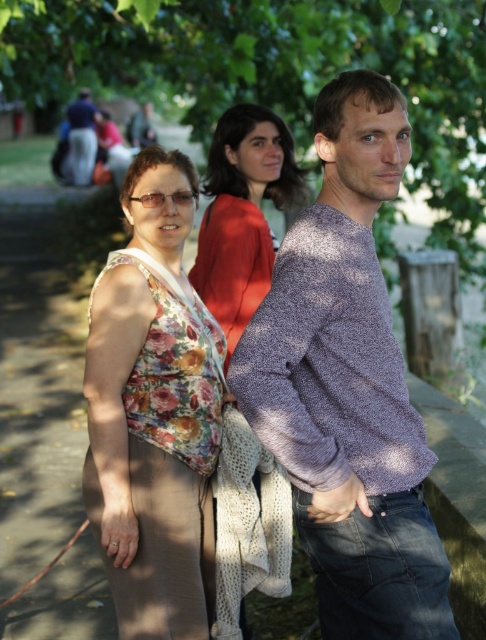
Between floral fabric top at center and dark blue sweater at center, which one appears on the left side from the viewer's perspective?

dark blue sweater at center

Which is in front, point (191, 387) or point (82, 164)?

Point (191, 387) is in front.

Describe the element at coordinates (151, 452) in the screenshot. This screenshot has height=640, width=486. I see `floral fabric top at center` at that location.

Find the location of a particular element. floral fabric top at center is located at coordinates (151, 452).

Can you confirm if purple textured sweater at center is taller than floral fabric top at center?

No.

Which of these two, purple textured sweater at center or floral fabric top at center, stands shorter?

purple textured sweater at center

Where is `purple textured sweater at center`? purple textured sweater at center is located at coordinates (347, 385).

Find the location of `purple textured sweater at center`. purple textured sweater at center is located at coordinates (347, 385).

Is green leafy tree at center further to the viewer compared to dark blue sweater at center?

No, it is in front of dark blue sweater at center.

Which is above, green leafy tree at center or dark blue sweater at center?

Positioned higher is green leafy tree at center.

Which is behind, point (431, 141) or point (81, 182)?

Point (81, 182)

Locate an element on the screen. The height and width of the screenshot is (640, 486). green leafy tree at center is located at coordinates (276, 72).